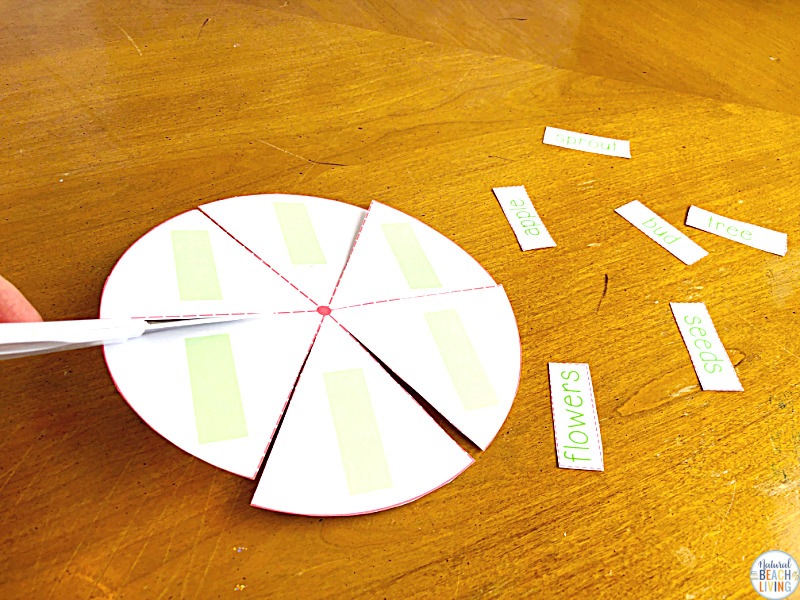
Find the location of a particular element. scratch marks on table is located at coordinates (194, 550), (169, 550), (145, 542), (116, 532), (89, 525), (46, 521), (24, 486).